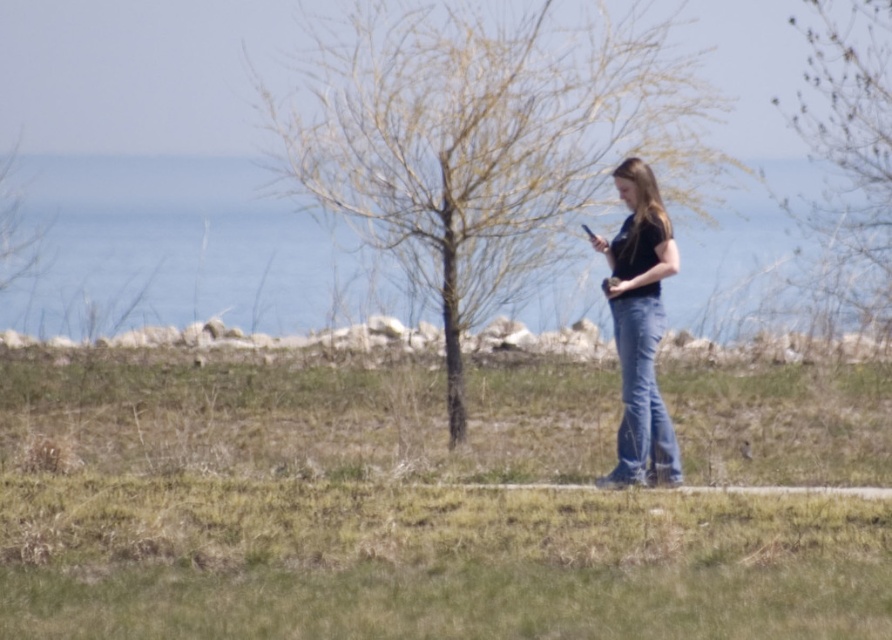
Can you confirm if bare branches at center is positioned to the right of denim jeans at center?

Incorrect, bare branches at center is not on the right side of denim jeans at center.

Is point (435, 154) in front of point (632, 449)?

No.

In order to click on bare branches at center in this screenshot , I will do `click(485, 141)`.

Is point (244, 557) closer to camera compared to point (628, 237)?

Yes, it is in front of point (628, 237).

Between point (796, 604) and point (643, 264), which one is positioned in front?

Point (796, 604) is in front.

Is point (294, 557) farther from camera compared to point (614, 292)?

No, it is in front of (614, 292).

Image resolution: width=892 pixels, height=640 pixels. I want to click on blue jeans at lower center, so click(386, 513).

Measure the distance between blue jeans at lower center and blue denim jeans at center.

blue jeans at lower center and blue denim jeans at center are 2.49 meters apart.

Can you confirm if blue jeans at lower center is positioned above blue denim jeans at center?

No, blue jeans at lower center is not above blue denim jeans at center.

At what (x,y) coordinates should I click in order to perform the action: click on blue jeans at lower center. Please return your answer as a coordinate pair (x, y). This screenshot has height=640, width=892. Looking at the image, I should click on (386, 513).